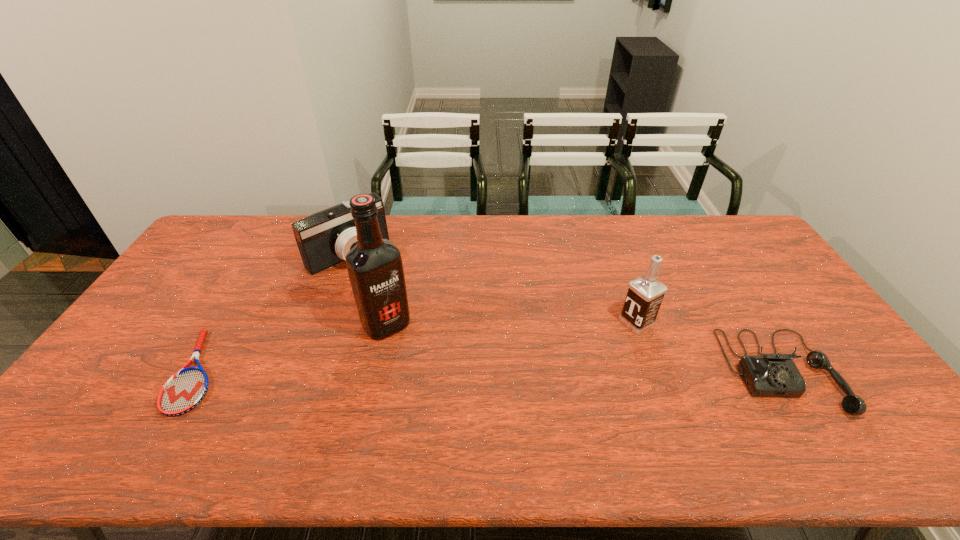
Find the location of `vacant space that's between the tallest object and the fourth tallest object`. vacant space that's between the tallest object and the fourth tallest object is located at coordinates (584, 348).

Find the location of a particular element. The width and height of the screenshot is (960, 540). blank region between the rightmost object and the liquor is located at coordinates (584, 348).

Identify the location of free point between the tallest object and the leftmost object. This screenshot has height=540, width=960. (293, 348).

This screenshot has width=960, height=540. In order to click on free area in between the farthest object and the rightmost object in this screenshot , I will do `click(564, 313)`.

The width and height of the screenshot is (960, 540). Identify the location of free spot between the fourth object from left to right and the tallest object. (512, 323).

Locate an element on the screen. The image size is (960, 540). free point between the second object from right to left and the tennis racket is located at coordinates (418, 347).

Where is `vacant space in between the fourth object from left to right and the tennis racket`? vacant space in between the fourth object from left to right and the tennis racket is located at coordinates (418, 347).

Find the location of a particular element. The width and height of the screenshot is (960, 540). free space between the telephone and the camcorder is located at coordinates (564, 313).

Select which object appears as the third closest to the rightmost object. Please provide its 2D coordinates. Your answer should be formatted as a tuple, i.e. [(x, y)], where the tuple contains the x and y coordinates of a point satisfying the conditions above.

[(324, 238)]

Where is `object that is the third nearest to the third shortest object`? object that is the third nearest to the third shortest object is located at coordinates (645, 294).